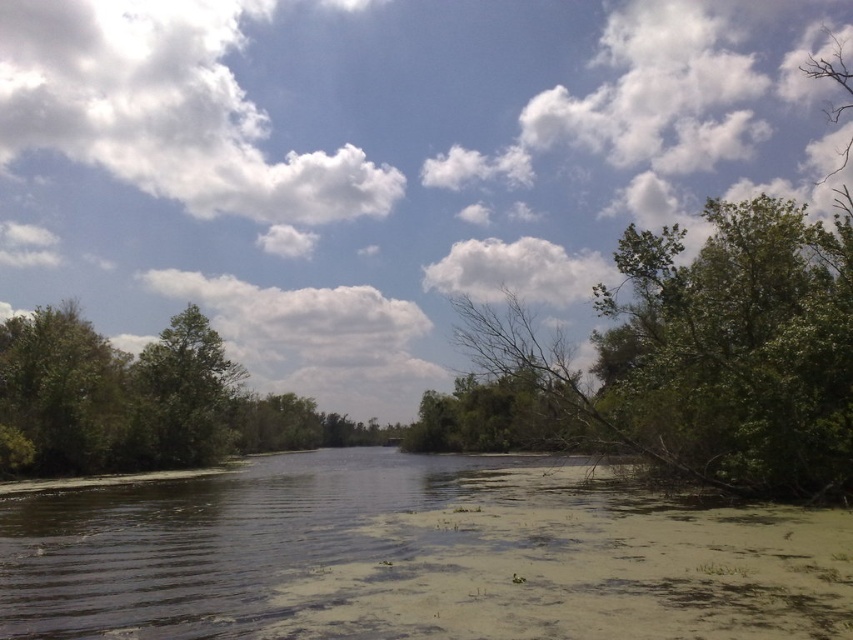
From the picture: You are standing at the edge of the water and want to take a photo of the green leafy tree at left. If your camera has a maximum zoom range of 50 meters, will you be able to capture the entire tree in the photo?

The green leafy tree at left is 43.92 meters away from the camera. Since the camera can zoom up to 50 meters, you can capture the entire tree in the photo because the distance is within the zoom range.

You are standing on the bank of the waterway and see the green leafy tree at left and the green leafy tree at center. Which tree is closer to you?

The green leafy tree at left is closer to you because it is positioned in front of the green leafy tree at center.

You are standing at the center of the waterway and want to know which tree is closer to you. Can you determine if the green leafy tree at upper right or the green leafy tree at left is closer based on their positions?

The green leafy tree at upper right is positioned over the green leafy tree at left, which means it is closer to you than the one on the left.